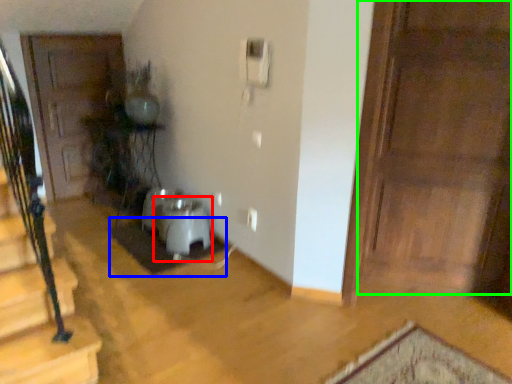
Question: Considering the real-world distances, which object is farthest from water heater (highlighted by a red box)? doormat (highlighted by a blue box) or door (highlighted by a green box)?

Choices:
 (A) doormat
 (B) door

Answer: (B)